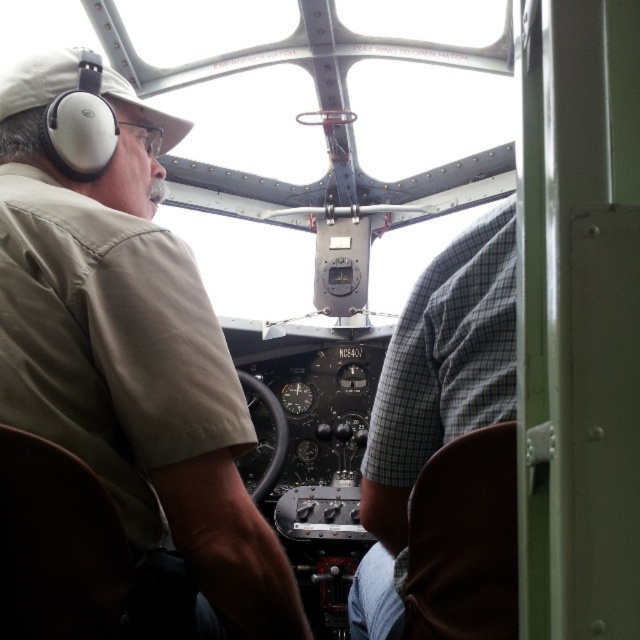
Does matte khaki shirt at left have a greater height compared to gray checkered shirt at center?

Yes, matte khaki shirt at left is taller than gray checkered shirt at center.

Is point (40, 202) positioned in front of point (497, 280)?

Yes.

Which is behind, point (76, 273) or point (442, 278)?

Point (442, 278)

Image resolution: width=640 pixels, height=640 pixels. I want to click on matte khaki shirt at left, so click(x=128, y=344).